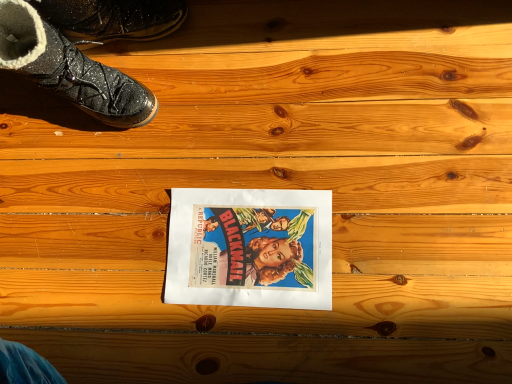
Question: Is matte paper movie poster at center to the right of shiny black boot at upper left, the first footwear in the bottom-to-top sequence, from the viewer's perspective?

Choices:
 (A) no
 (B) yes

Answer: (B)

Question: Can shiny black boot at upper left, the first footwear in the bottom-to-top sequence, be found inside matte paper movie poster at center?

Choices:
 (A) no
 (B) yes

Answer: (A)

Question: Considering the relative sizes of matte paper movie poster at center and shiny black boot at upper left, the first footwear in the bottom-to-top sequence, in the image provided, is matte paper movie poster at center thinner than shiny black boot at upper left, the first footwear in the bottom-to-top sequence,?

Choices:
 (A) yes
 (B) no

Answer: (B)

Question: Does matte paper movie poster at center have a larger size compared to shiny black boot at upper left, which is the 2th footwear from top to bottom?

Choices:
 (A) yes
 (B) no

Answer: (B)

Question: Is matte paper movie poster at center closer to camera compared to shiny black boot at upper left, the first footwear in the bottom-to-top sequence?

Choices:
 (A) yes
 (B) no

Answer: (B)

Question: Can you confirm if matte paper movie poster at center is shorter than shiny black boot at upper left, which is the 2th footwear from top to bottom?

Choices:
 (A) yes
 (B) no

Answer: (A)

Question: Considering the relative positions of sparkly black boot at upper left, placed as the 2th footwear when sorted from bottom to top, and shiny black boot at upper left, the first footwear in the bottom-to-top sequence, in the image provided, is sparkly black boot at upper left, placed as the 2th footwear when sorted from bottom to top, to the right of shiny black boot at upper left, the first footwear in the bottom-to-top sequence, from the viewer's perspective?

Choices:
 (A) yes
 (B) no

Answer: (A)

Question: From a real-world perspective, is sparkly black boot at upper left, which is the 1th footwear from top to bottom, positioned under shiny black boot at upper left, the first footwear in the bottom-to-top sequence, based on gravity?

Choices:
 (A) no
 (B) yes

Answer: (B)

Question: Is sparkly black boot at upper left, which is the 1th footwear from top to bottom, located outside shiny black boot at upper left, the first footwear in the bottom-to-top sequence?

Choices:
 (A) no
 (B) yes

Answer: (B)

Question: From the image's perspective, does sparkly black boot at upper left, which is the 1th footwear from top to bottom, appear higher than shiny black boot at upper left, the first footwear in the bottom-to-top sequence?

Choices:
 (A) yes
 (B) no

Answer: (A)

Question: Is the depth of sparkly black boot at upper left, which is the 1th footwear from top to bottom, greater than that of shiny black boot at upper left, the first footwear in the bottom-to-top sequence?

Choices:
 (A) no
 (B) yes

Answer: (B)

Question: From a real-world perspective, is sparkly black boot at upper left, placed as the 2th footwear when sorted from bottom to top, located higher than shiny black boot at upper left, the first footwear in the bottom-to-top sequence?

Choices:
 (A) yes
 (B) no

Answer: (B)

Question: Does matte paper movie poster at center have a lesser width compared to sparkly black boot at upper left, placed as the 2th footwear when sorted from bottom to top?

Choices:
 (A) yes
 (B) no

Answer: (B)